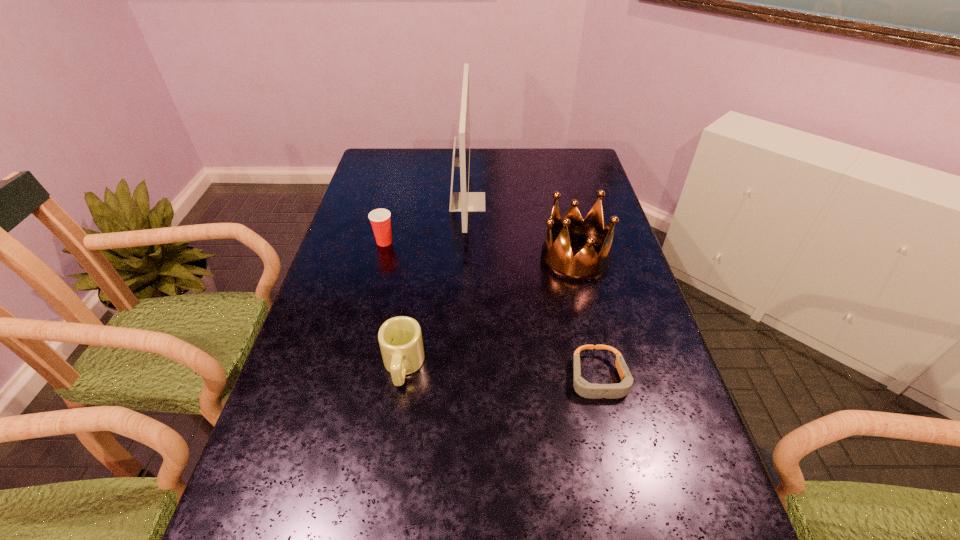
Where is `monitor`? monitor is located at coordinates (464, 201).

The height and width of the screenshot is (540, 960). I want to click on the tallest object, so [x=464, y=201].

At what (x,y) coordinates should I click in order to perform the action: click on the second tallest object. Please return your answer as a coordinate pair (x, y). This screenshot has width=960, height=540. Looking at the image, I should click on (587, 265).

At what (x,y) coordinates should I click in order to perform the action: click on Dixie cup. Please return your answer as a coordinate pair (x, y). Looking at the image, I should click on (380, 219).

Where is `the second object from left to right`? The image size is (960, 540). the second object from left to right is located at coordinates (400, 339).

At what (x,y) coordinates should I click in order to perform the action: click on goggles. Please return your answer as a coordinate pair (x, y). Looking at the image, I should click on (582, 387).

You are a GUI agent. You are given a task and a screenshot of the screen. Output one action in this format:
    pyautogui.click(x=<x>, y=<y>)
    Task: Click on the vacant position located 0.060m on the front-facing side of the tallest object
    
    Given the screenshot: What is the action you would take?
    pyautogui.click(x=503, y=202)

Identify the location of blank space located 0.280m on the front of the crown. Image resolution: width=960 pixels, height=540 pixels. (601, 366).

Locate an element on the screen. This screenshot has height=540, width=960. vacant space located on the front of the leftmost object is located at coordinates (378, 266).

The height and width of the screenshot is (540, 960). I want to click on free space located 0.090m with the handle on the side of the fourth object from right to left, so click(394, 430).